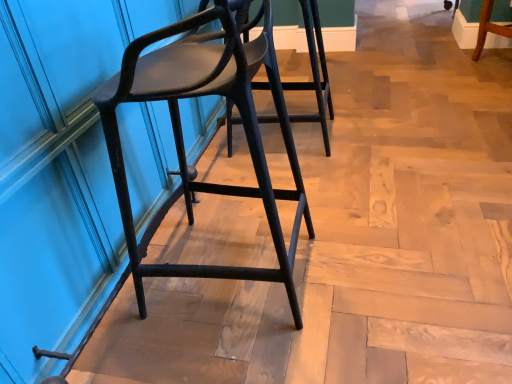
This screenshot has height=384, width=512. What do you see at coordinates (182, 134) in the screenshot?
I see `matte black chair at left` at bounding box center [182, 134].

Measure the distance between matte black chair at left and camera.

matte black chair at left is 72.27 centimeters away from camera.

Where is `matte black chair at left`? The height and width of the screenshot is (384, 512). matte black chair at left is located at coordinates (182, 134).

Identify the location of matte black chair at left. This screenshot has width=512, height=384. (182, 134).